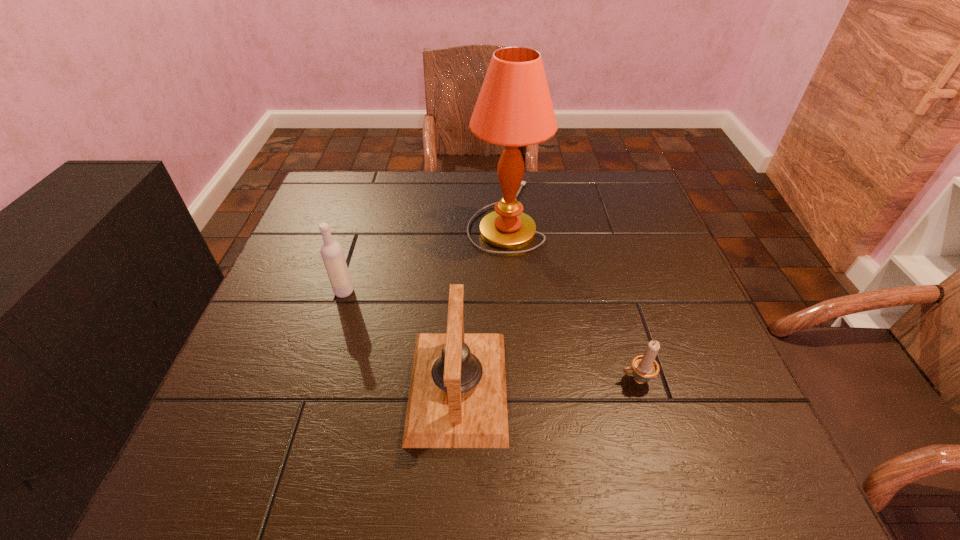
The height and width of the screenshot is (540, 960). Identify the location of free location located on the handle side of the rightmost object. (503, 380).

At what (x,y) coordinates should I click in order to perform the action: click on free space located 0.390m on the handle side of the rightmost object. Please return your answer as a coordinate pair (x, y). The height and width of the screenshot is (540, 960). Looking at the image, I should click on (413, 380).

Find the location of `free space located 0.340m on the handle side of the rightmost object`. free space located 0.340m on the handle side of the rightmost object is located at coordinates (439, 380).

Identify the location of object present at the far edge. This screenshot has height=540, width=960. (514, 108).

Image resolution: width=960 pixels, height=540 pixels. In order to click on object located at the near edge in this screenshot , I will do `click(457, 398)`.

You are a GUI agent. You are given a task and a screenshot of the screen. Output one action in this format:
    pyautogui.click(x=<x>, y=<y>)
    Task: Click on the object situated at the left edge
    The image size is (960, 540).
    Given the screenshot: What is the action you would take?
    pyautogui.click(x=331, y=251)

What are the coordinates of `object positioned at the right edge` in the screenshot? It's located at (645, 367).

Locate an element on the screen. The image size is (960, 540). vacant space at the far edge is located at coordinates (589, 205).

The width and height of the screenshot is (960, 540). In order to click on vacant region at the near edge of the desktop in this screenshot , I will do `click(285, 482)`.

You are a GUI agent. You are given a task and a screenshot of the screen. Output one action in this format:
    pyautogui.click(x=<x>, y=<y>)
    Task: Click on the free space at the left edge of the desktop
    The height and width of the screenshot is (540, 960).
    Given the screenshot: What is the action you would take?
    click(287, 320)